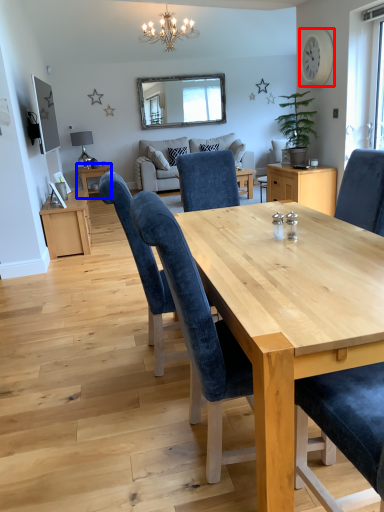
Question: Among these objects, which one is nearest to the camera, clock (highlighted by a red box) or table (highlighted by a blue box)?

Choices:
 (A) clock
 (B) table

Answer: (A)